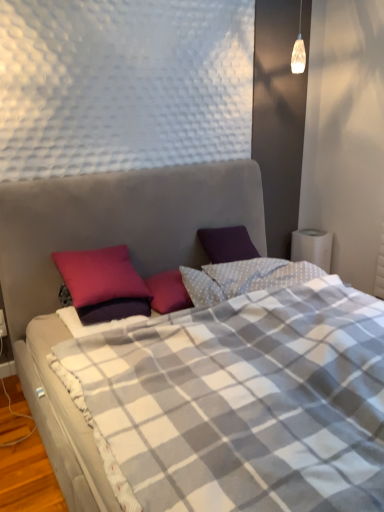
Question: Is white plastic electric outlet at lower left in front of or behind purple matte pillow at upper left in the image?

Choices:
 (A) front
 (B) behind

Answer: (B)

Question: In terms of size, does white plastic electric outlet at lower left appear bigger or smaller than purple matte pillow at upper left?

Choices:
 (A) big
 (B) small

Answer: (B)

Question: Which object is positioned closest to the purple matte pillow at upper left?

Choices:
 (A) plaid fabric bed at center
 (B) white plastic electric outlet at lower left

Answer: (A)

Question: Which object is the farthest from the white plastic electric outlet at lower left?

Choices:
 (A) purple matte pillow at upper left
 (B) plaid fabric bed at center

Answer: (B)